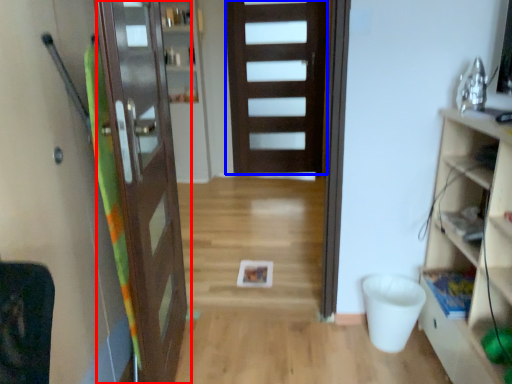
Question: Which object is closer to the camera taking this photo, door (highlighted by a red box) or door (highlighted by a blue box)?

Choices:
 (A) door
 (B) door

Answer: (A)